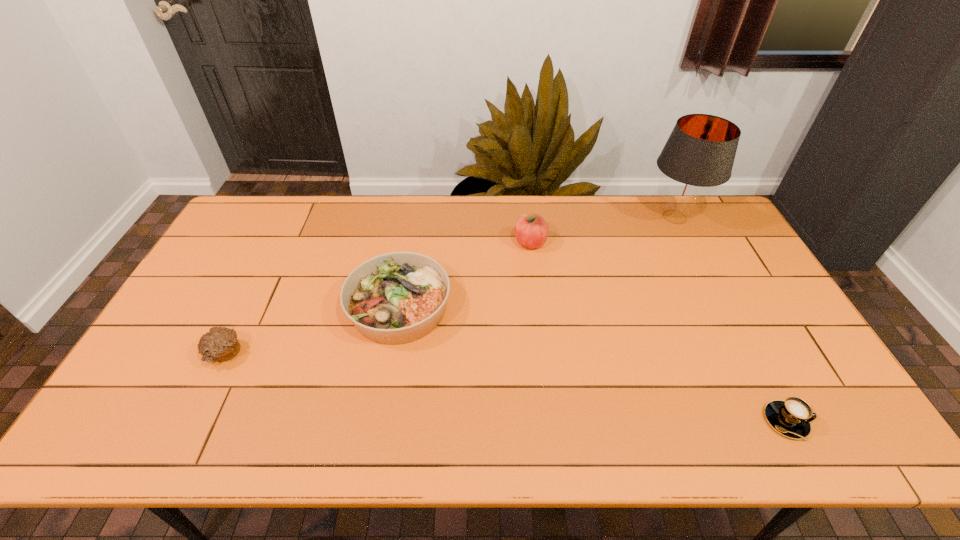
Identify the location of the tallest object. (699, 154).

Image resolution: width=960 pixels, height=540 pixels. What are the coordinates of `the fourth shortest object` in the screenshot? It's located at (531, 230).

Where is `apple`? apple is located at coordinates (531, 230).

Identify the location of the second object from left to right. Image resolution: width=960 pixels, height=540 pixels. (395, 298).

Where is `salad plate`? salad plate is located at coordinates (395, 298).

This screenshot has height=540, width=960. What are the coordinates of `muffin` in the screenshot? It's located at (219, 344).

Identify the location of the shortest object. (792, 417).

Find the location of a particular element. cappuccino is located at coordinates (792, 417).

Locate an element on the screen. The width and height of the screenshot is (960, 540). free point located 0.240m on the left of the lampshade is located at coordinates (576, 217).

Where is `free space located 0.220m on the front of the third object from right to left`? This screenshot has height=540, width=960. free space located 0.220m on the front of the third object from right to left is located at coordinates (538, 305).